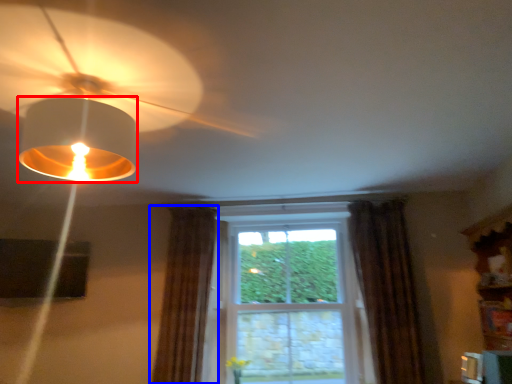
Question: Which of the following is the farthest to the observer, lamp (highlighted by a red box) or curtain (highlighted by a blue box)?

Choices:
 (A) lamp
 (B) curtain

Answer: (B)